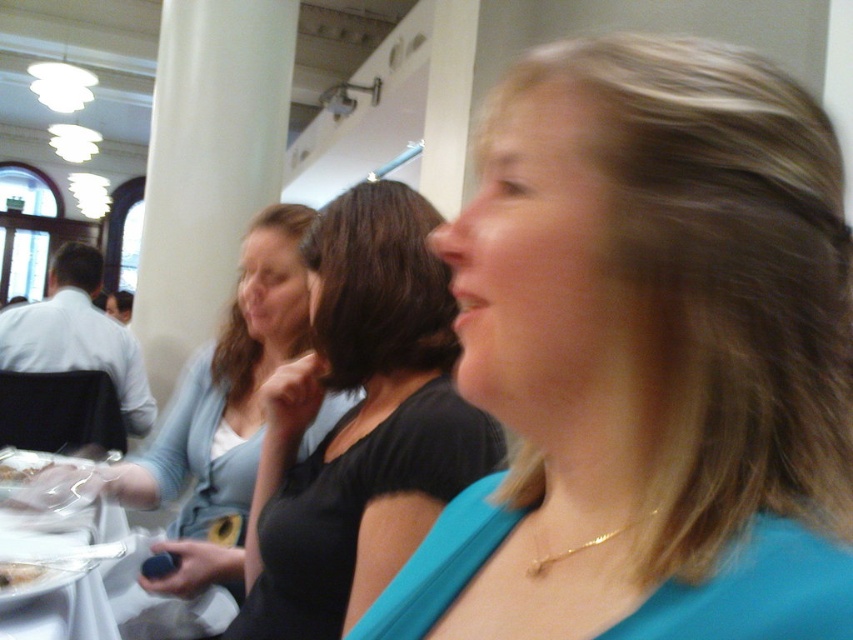
Which is above, light blue sweater at center or white plastic bag at lower left?

light blue sweater at center is above.

Which of these two, light blue sweater at center or white plastic bag at lower left, stands shorter?

Standing shorter between the two is white plastic bag at lower left.

The height and width of the screenshot is (640, 853). In order to click on light blue sweater at center in this screenshot , I will do `click(222, 410)`.

Does point (47, 548) come closer to viewer compared to point (21, 481)?

Yes, point (47, 548) is in front of point (21, 481).

Measure the distance between clear plastic plate at lower left and camera.

clear plastic plate at lower left and camera are 34.16 inches apart from each other.

Is point (16, 584) positioned after point (35, 474)?

No, (16, 584) is in front of (35, 474).

The width and height of the screenshot is (853, 640). I want to click on clear plastic plate at lower left, so click(57, 552).

Is clear plastic plate at lower left shorter than white paper plate at lower left?

No.

Looking at this image, between clear plastic plate at lower left and white paper plate at lower left, which one has more height?

Standing taller between the two is clear plastic plate at lower left.

Is point (54, 474) positioned behind point (25, 564)?

Yes, it is behind point (25, 564).

Locate an element on the screen. The image size is (853, 640). clear plastic plate at lower left is located at coordinates (57, 552).